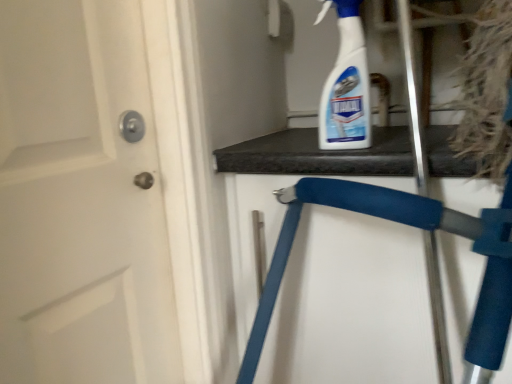
Where is `free space to the back side of white plastic spray bottle at upper right`? This screenshot has width=512, height=384. free space to the back side of white plastic spray bottle at upper right is located at coordinates [316, 134].